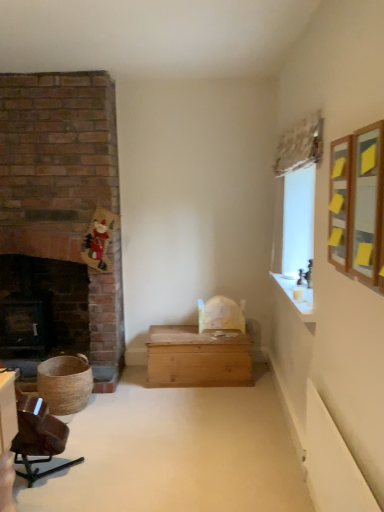
Image resolution: width=384 pixels, height=512 pixels. I want to click on vacant space in black cast iron fireplace at left (from a real-world perspective), so click(36, 354).